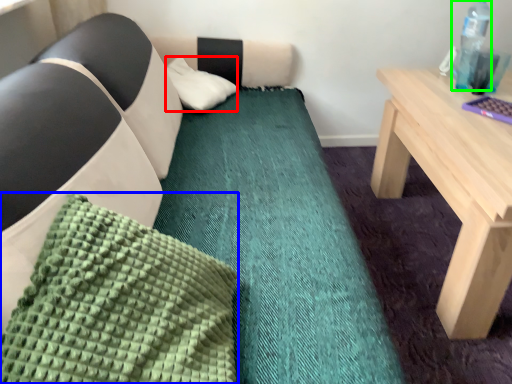
Question: Which object is positioned closest to pillow (highlighted by a red box)? Select from pillow (highlighted by a blue box) and bottle (highlighted by a green box).

Choices:
 (A) pillow
 (B) bottle

Answer: (B)